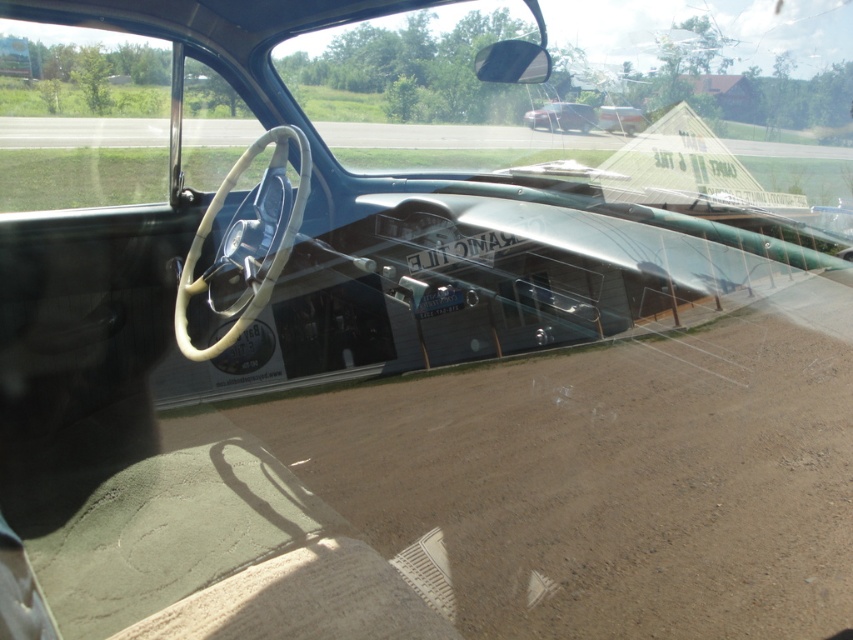
Does brown dirt track at center have a greater height compared to shiny metallic car at upper center?

Correct, brown dirt track at center is much taller as shiny metallic car at upper center.

In the scene shown: Who is more distant from viewer, (757,452) or (595,116)?

The point (595,116) is behind.

This screenshot has width=853, height=640. Identify the location of brown dirt track at center. (607, 476).

Who is positioned more to the left, brown dirt track at center or metallic silver sedan at center?

Positioned to the left is brown dirt track at center.

Is brown dirt track at center to the right of metallic silver sedan at center from the viewer's perspective?

No, brown dirt track at center is not to the right of metallic silver sedan at center.

Does point (575, 541) come behind point (628, 134)?

No, it is in front of (628, 134).

This screenshot has height=640, width=853. In order to click on brown dirt track at center in this screenshot , I will do `click(607, 476)`.

Which of these two, glossy plastic view mirror at upper right or metallic silver sedan at center, stands taller?

Result: metallic silver sedan at center is taller.

Does glossy plastic view mirror at upper right appear over metallic silver sedan at center?

Actually, glossy plastic view mirror at upper right is below metallic silver sedan at center.

Who is more forward, [495,42] or [619,124]?

Positioned in front is point [495,42].

This screenshot has width=853, height=640. What are the coordinates of `glossy plastic view mirror at upper right` in the screenshot? It's located at tap(512, 61).